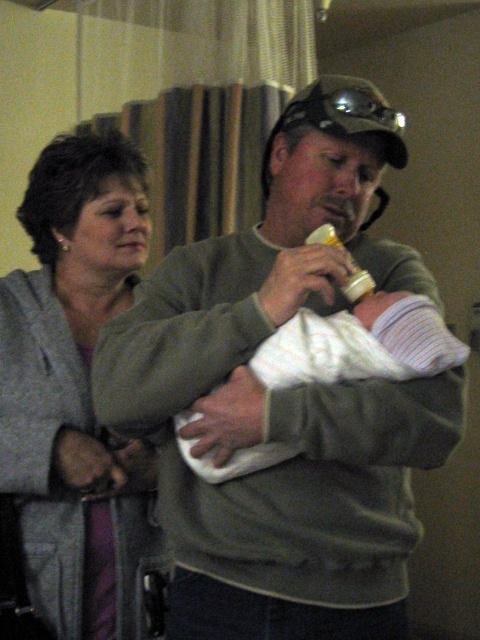
You are organizing a charity event and need to determine which item to place in a donation box. The donation box can only accommodate items smaller than the gray fleece jacket at upper left. Based on the scene, will the white soft cloth at center fit in the donation box?

The gray fleece jacket at upper left has a larger size compared to the white soft cloth at center, so the white soft cloth at center is smaller and will fit in the donation box.

You are a photographer setting up a shoot in this scene. You need to place a spotlight on the green matte sweater at center and the gray fleece jacket at upper left. According to their positions, which object should you light first if you start from the left side of the scene?

The gray fleece jacket at upper left should be lit first because it is positioned on the left side of the green matte sweater at center.

You are organizing a charity event and need to place the gray fleece jacket at upper left and the white soft cloth at center on a display table. Since space is limited, which item should you choose to place first to ensure both fit properly?

Result: The gray fleece jacket at upper left has a lesser width compared to the white soft cloth at center. Therefore, you should place the white soft cloth at center first to accommodate its larger size, then fit the gray fleece jacket at upper left alongside it.